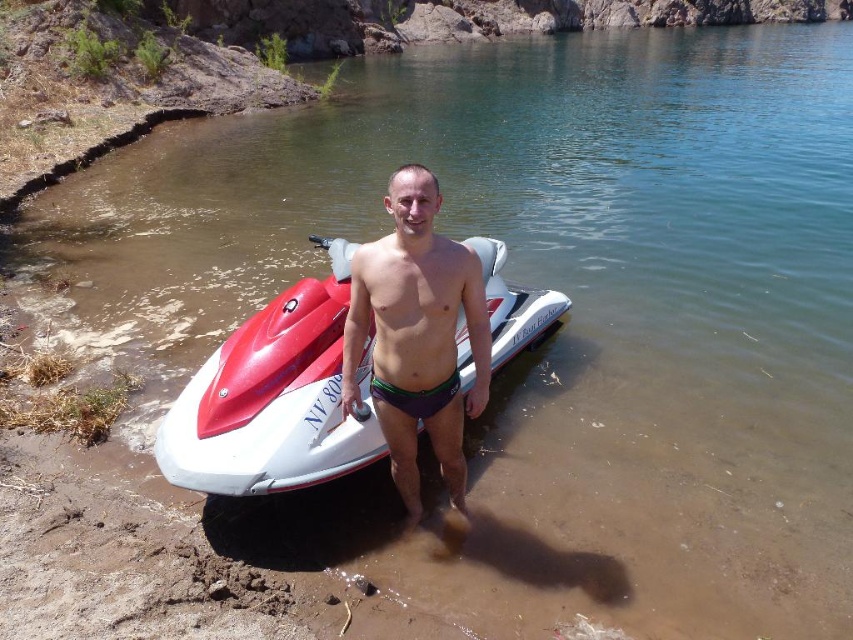
You are a photographer trying to capture the red glossy jet ski at center and the purple matte swim trunks at center in a single shot. Based on their positions, which object should you adjust your camera to focus on first to ensure both are in frame?

The red glossy jet ski at center is to the left of purple matte swim trunks at center, so you should focus on the red glossy jet ski at center first to ensure both are in frame.

You are standing at the shoreline and want to reach the point marked at coordinates (357, 436). Given that the water depth there is 0.5 meters, can you safely walk to that point without getting your feet wet?

The point marked at coordinates (357, 436) is 4.85 meters away from the viewer. However, the water depth at that point is 0.5 meters, so walking there would result in getting your feet wet.